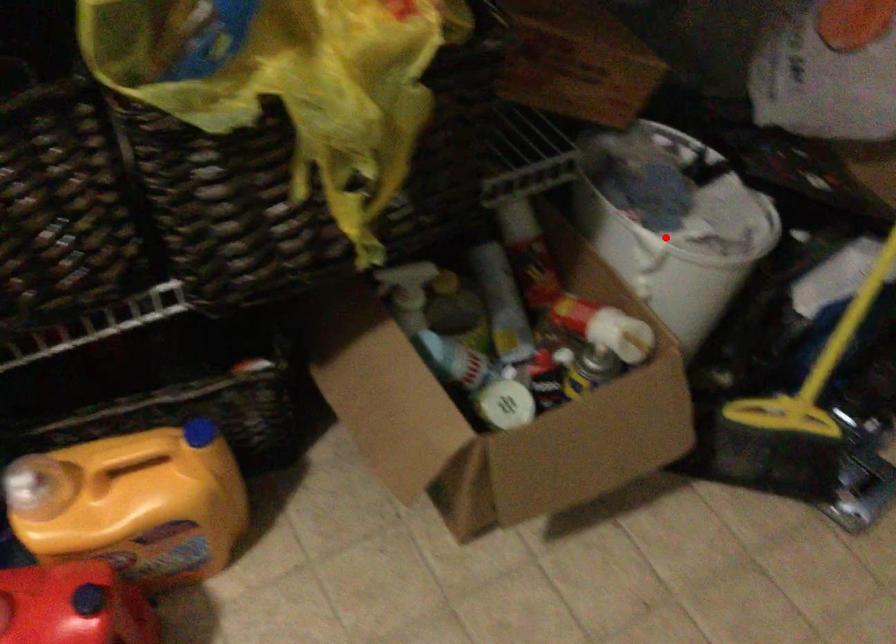
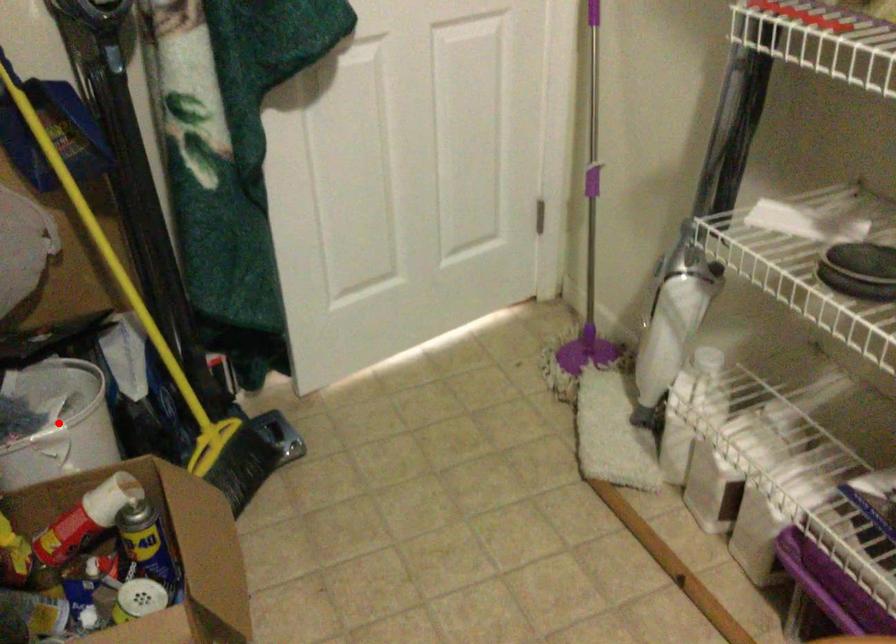
I am providing you with two images of the same scene from different viewpoints. A red point is marked on the first image and another point is marked on the second image. Do the highlighted points in image1 and image2 indicate the same real-world spot?

Yes